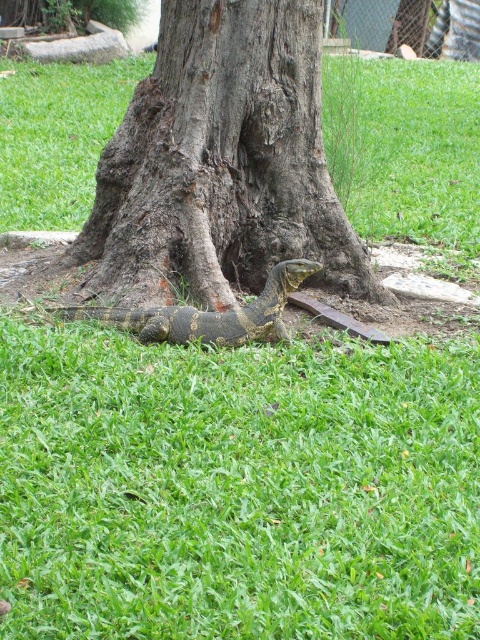
Question: Does brown rough bark tree at center have a smaller size compared to yellow-green scaly lizard at lower center?

Choices:
 (A) yes
 (B) no

Answer: (B)

Question: Does brown rough bark tree at center have a greater width compared to yellow-green scaly lizard at lower center?

Choices:
 (A) yes
 (B) no

Answer: (A)

Question: Which object appears closest to the camera in this image?

Choices:
 (A) brown rough bark tree at center
 (B) yellow-green scaly lizard at lower center

Answer: (B)

Question: Which point is farther to the camera?

Choices:
 (A) brown rough bark tree at center
 (B) yellow-green scaly lizard at lower center

Answer: (A)

Question: Does brown rough bark tree at center have a larger size compared to yellow-green scaly lizard at lower center?

Choices:
 (A) yes
 (B) no

Answer: (A)